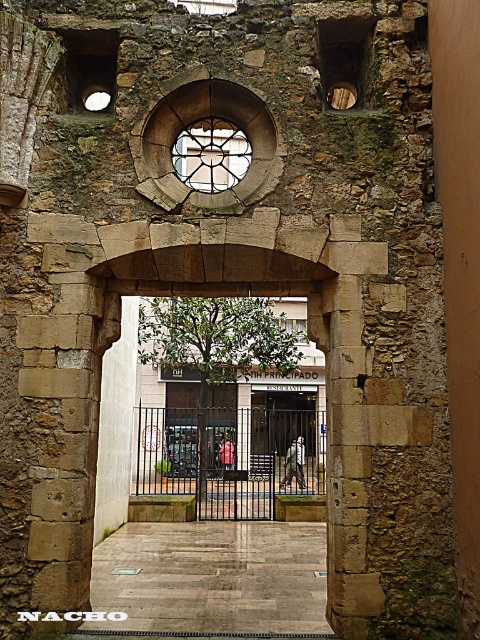
You are standing in front of the stone archway at center and the stained glass window at center. Which structure is closer to you?

The stone archway at center is closer to the viewer than the stained glass window at center.

You are an architect examining the historical structure. You notice the brown rough stone pillar at right and the cracked stone archway at center. Which one has a greater height?

The brown rough stone pillar at right is taller than the cracked stone archway at center.